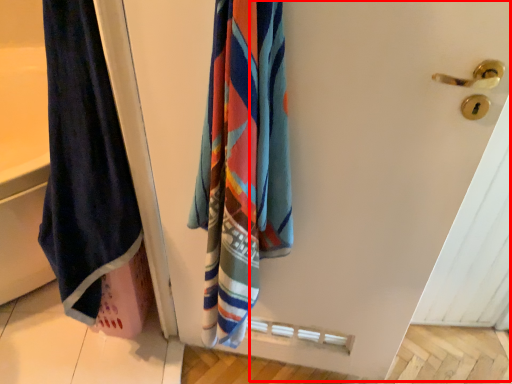
Question: From the image's perspective, what is the correct spatial relationship of screen door (annotated by the red box) in relation to towel?

Choices:
 (A) below
 (B) above

Answer: (A)